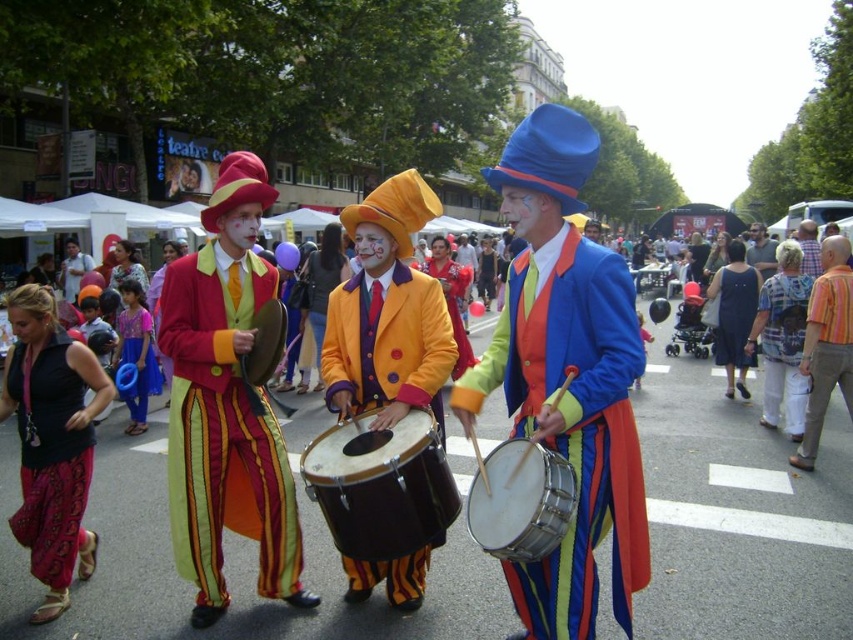
You are a photographer standing at the front of the crowd, wanting to capture a clear shot of both the white drum at center and the smooth brown leather jacket at center. Which object should you focus on first to ensure both are in focus?

The white drum at center is closer to the viewer than the smooth brown leather jacket at center. To ensure both are in focus, you should focus on the white drum at center first, as it is the closer object, and use a smaller aperture or adjust your focus point accordingly.